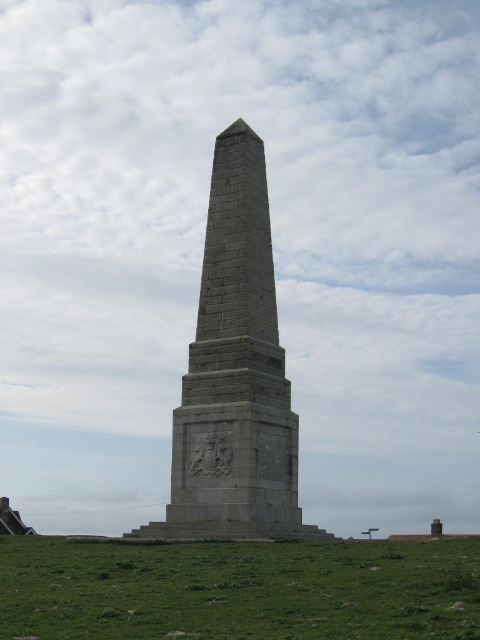
You are standing at the center of the image. Which direction should you walk to reach the green grassy field at lower center?

Since the green grassy field at lower center is located at point coordinates of 0.922 on the x axis and 0.498 on the y axis, you should walk towards the lower center direction to reach it.

You are standing on the green grassy field at lower center and want to walk to the gray stone obelisk at center. In which direction should you head?

You should head to the right since the green grassy field at lower center is positioned on the left side of gray stone obelisk at center, meaning the obelisk is to your right.